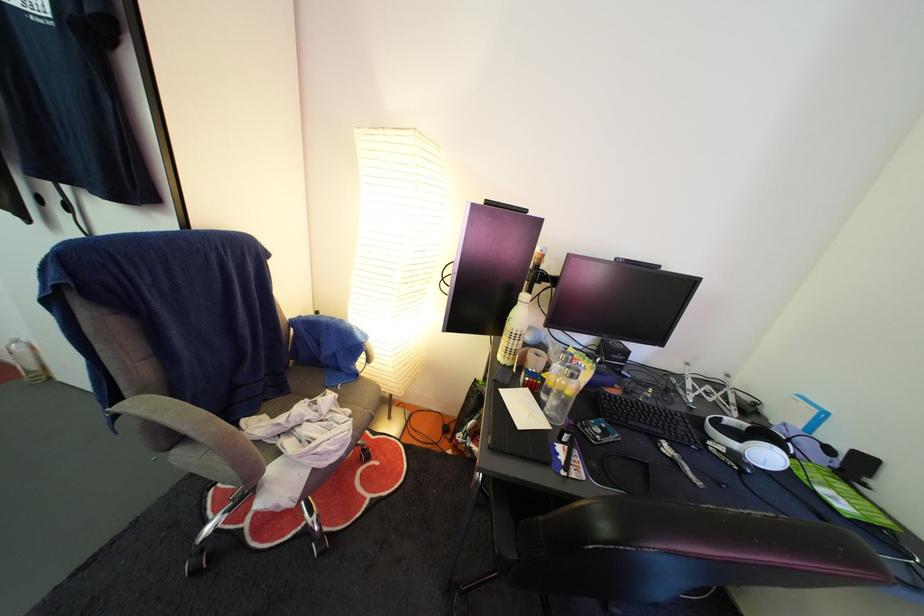
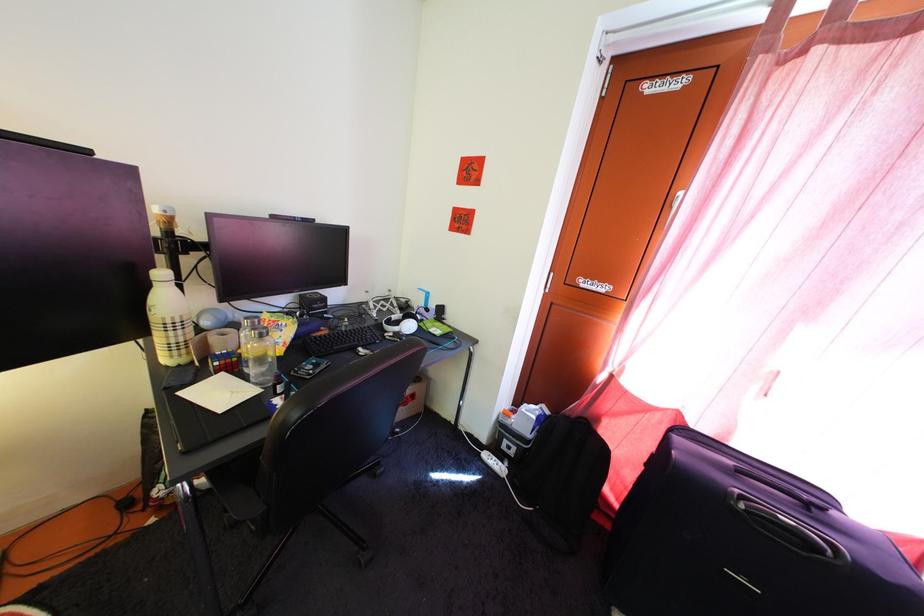
In the second image, find the point that corresponds to (x=536, y=387) in the first image.

(225, 371)